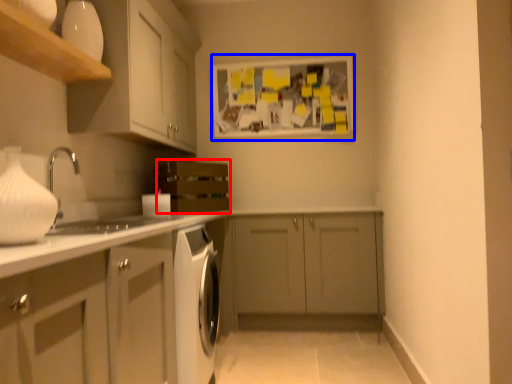
Question: Which of the following is the farthest to the observer, oven (highlighted by a red box) or bulletin board (highlighted by a blue box)?

Choices:
 (A) oven
 (B) bulletin board

Answer: (B)